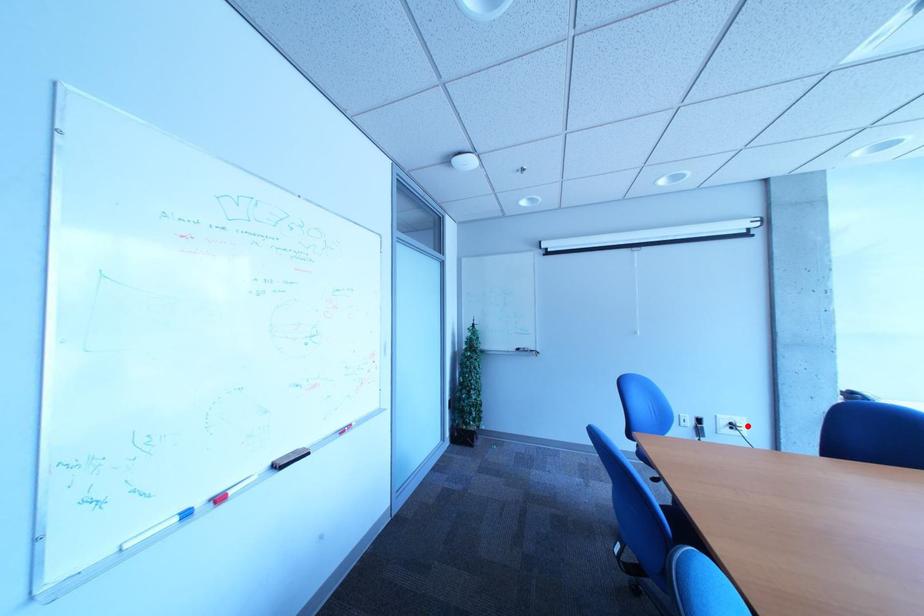
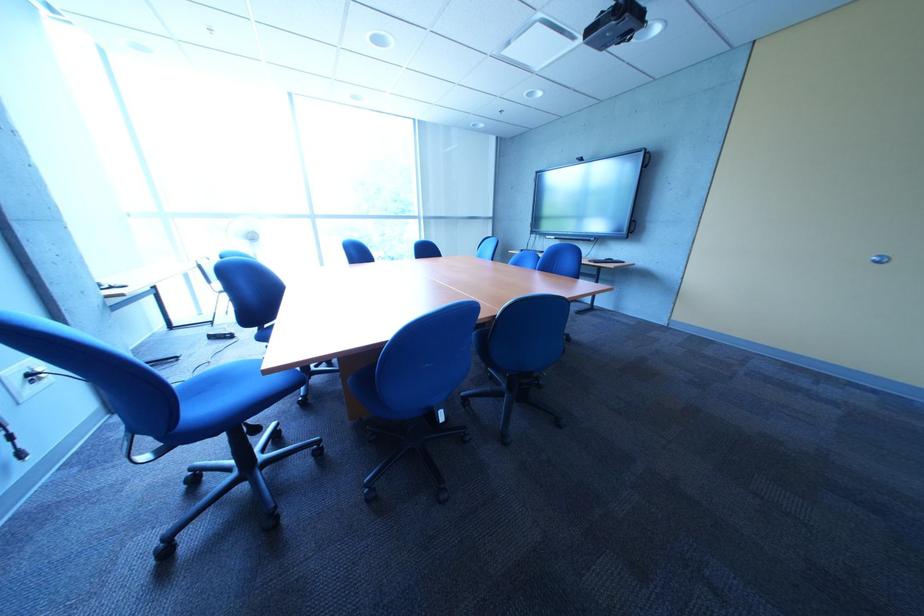
Locate, in the second image, the point that corresponds to the highlighted location in the first image.

(46, 377)